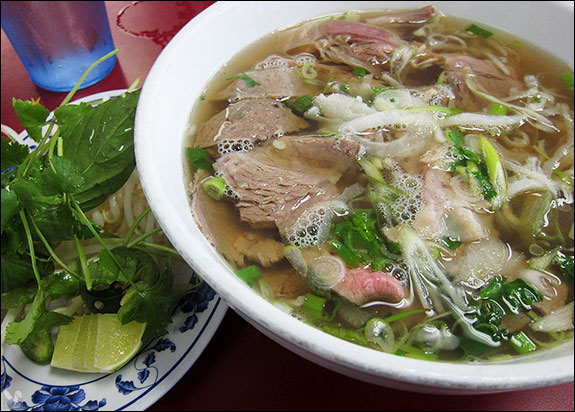
Identify the location of blue cup. [x=56, y=39].